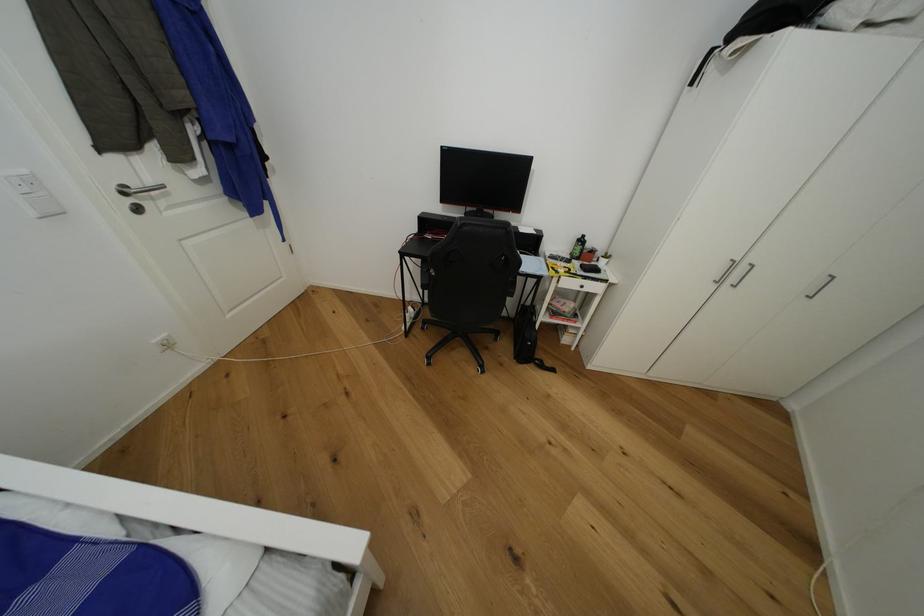
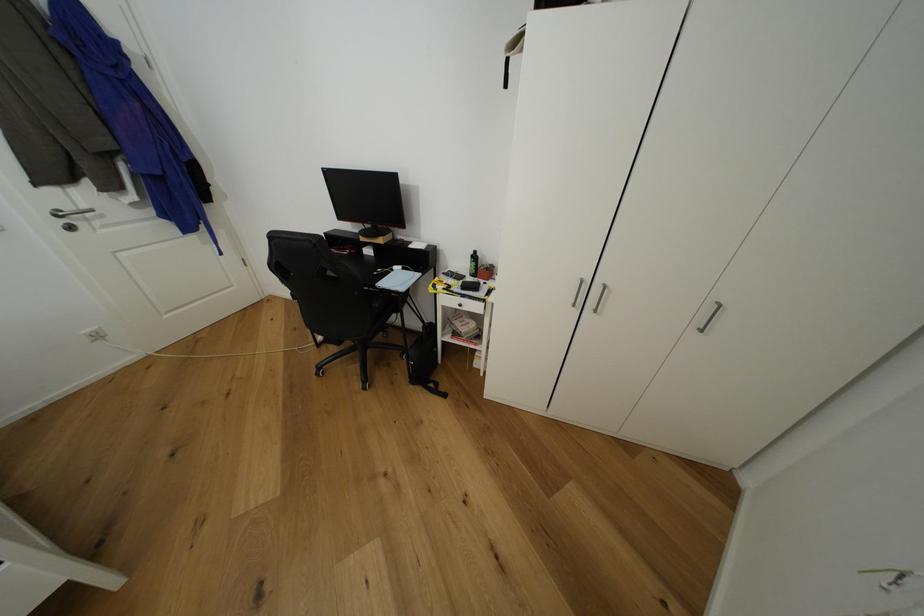
Locate, in the second image, the point that corresponds to the point at 584,241 in the first image.

(478, 257)